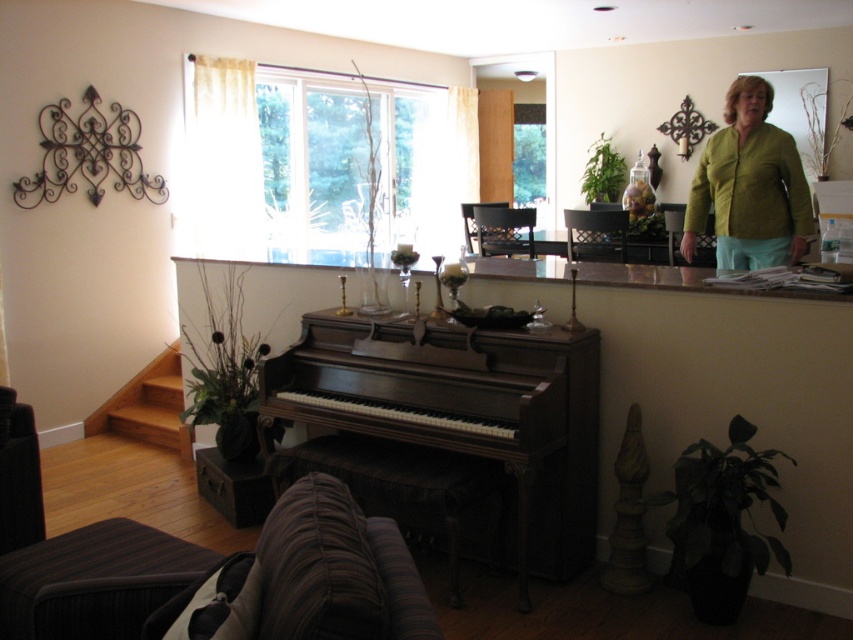
Which is below, green textured blouse at upper right or brown leather stool at lower center?

brown leather stool at lower center

Does green textured blouse at upper right have a lesser width compared to brown leather stool at lower center?

Correct, green textured blouse at upper right's width is less than brown leather stool at lower center's.

Is point (801, 253) closer to viewer compared to point (265, 461)?

No.

Identify the location of green textured blouse at upper right. (749, 186).

Does dark wood piano at center lie in front of brown fabric stool at lower left?

No, it is behind brown fabric stool at lower left.

Which is above, dark wood piano at center or brown fabric stool at lower left?

dark wood piano at center

Identify the location of dark wood piano at center. (450, 433).

Can you confirm if brown fabric stool at lower left is taller than green textured blouse at upper right?

No, brown fabric stool at lower left is not taller than green textured blouse at upper right.

Between point (175, 556) and point (766, 225), which one is positioned in front?

Point (175, 556) is in front.

Which is behind, point (160, 554) or point (729, 184)?

Positioned behind is point (729, 184).

The height and width of the screenshot is (640, 853). In order to click on brown fabric stool at lower left in this screenshot , I will do `click(96, 580)`.